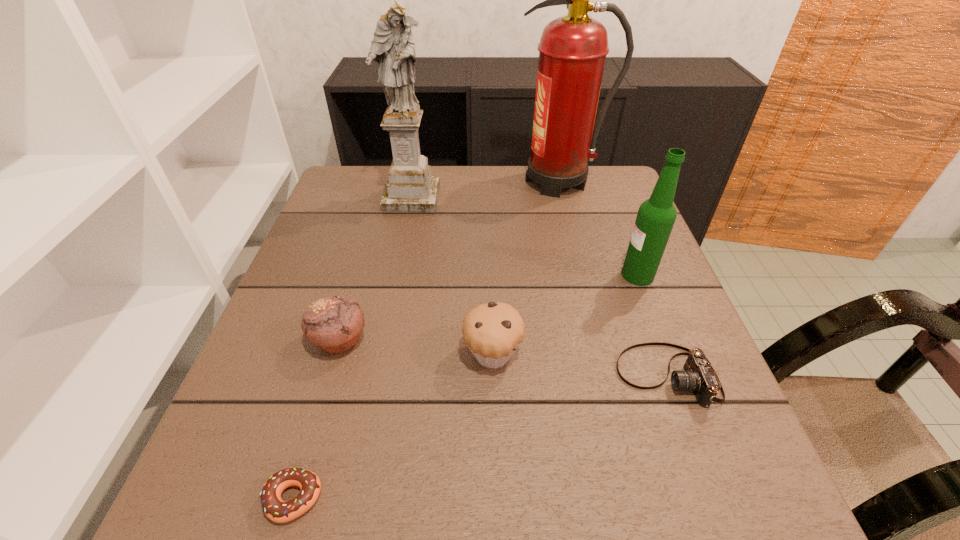
Where is `free space located 0.130m on the front-facing side of the fire extinguisher`? free space located 0.130m on the front-facing side of the fire extinguisher is located at coordinates (x=465, y=181).

This screenshot has height=540, width=960. What are the coordinates of `vacant space located on the front-facing side of the fire extinguisher` in the screenshot? It's located at (465, 181).

Locate an element on the screen. vacant space located on the front-facing side of the sculpture is located at coordinates (394, 283).

The height and width of the screenshot is (540, 960). Identify the location of free space located on the label of the fifth nearest object. (460, 275).

This screenshot has width=960, height=540. I want to click on free space located 0.340m on the label of the fifth nearest object, so click(x=468, y=275).

The width and height of the screenshot is (960, 540). Identify the location of free space located 0.150m on the label of the fifth nearest object. (554, 275).

At what (x,y) coordinates should I click in order to perform the action: click on free space located 0.220m on the front of the right muffin. Please return your answer as a coordinate pair (x, y). Image resolution: width=960 pixels, height=540 pixels. Looking at the image, I should click on (497, 513).

The height and width of the screenshot is (540, 960). I want to click on vacant space located on the back of the left muffin, so click(x=369, y=242).

Identify the location of vacant area situated on the front-facing side of the camera. (400, 376).

At what (x,y) coordinates should I click in order to perform the action: click on free location located 0.370m on the front-facing side of the camera. Please return your answer as a coordinate pair (x, y). Looking at the image, I should click on 411,376.